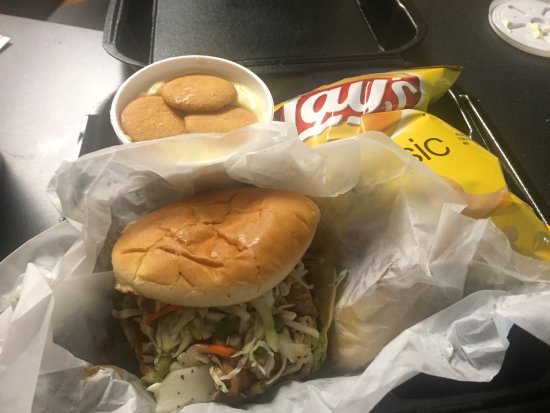
I want to click on black tray, so [478, 140], [335, 32].